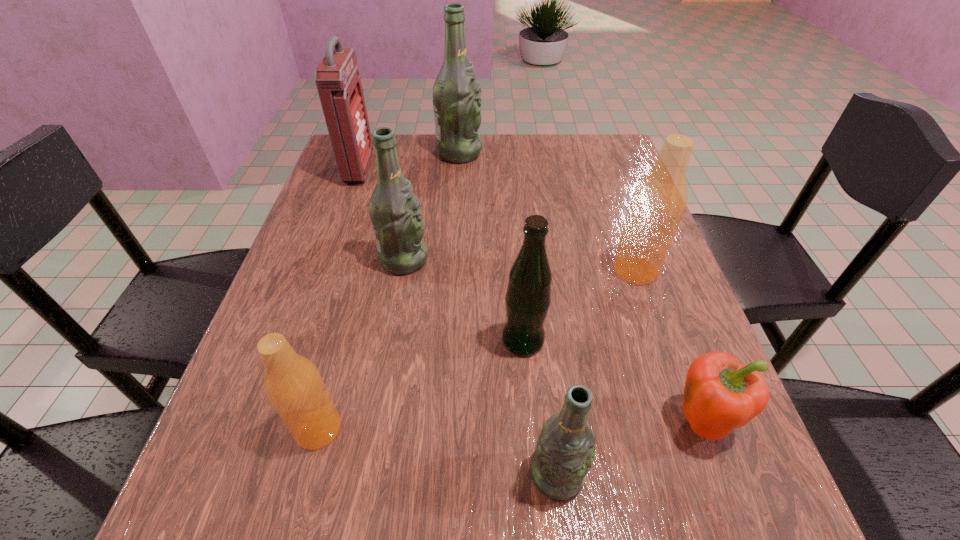
The image size is (960, 540). In the image, there is a desktop. Identify the location of free space at the near edge. (442, 497).

Find the location of `blank space at the left edge of the desktop`. blank space at the left edge of the desktop is located at coordinates (256, 443).

In the image, there is a desktop. Identify the location of vacant space at the right edge. The image size is (960, 540). (639, 405).

Identify the location of free spot between the left tan beer bottle and the pepper. This screenshot has width=960, height=540. (511, 425).

Where is `empty space between the shortest object and the third nearest green beer bottle`? Image resolution: width=960 pixels, height=540 pixels. empty space between the shortest object and the third nearest green beer bottle is located at coordinates (553, 340).

The image size is (960, 540). Find the location of `vacant space that's between the smallest green beer bottle and the farther tan beer bottle`. vacant space that's between the smallest green beer bottle and the farther tan beer bottle is located at coordinates (596, 372).

You are a GUI agent. You are given a task and a screenshot of the screen. Output one action in this format:
    pyautogui.click(x=<x>, y=<y>)
    Task: Click on the vacant region between the right tan beer bottle and the nearer tan beer bottle
    This screenshot has height=540, width=960.
    Given the screenshot: What is the action you would take?
    pyautogui.click(x=477, y=349)

I want to click on empty space between the biggest green beer bottle and the left tan beer bottle, so click(389, 291).

Identify the location of free space between the red first-aid kit and the smallest green beer bottle. Image resolution: width=960 pixels, height=540 pixels. (458, 322).

Locate an element on the screen. free space between the nearer tan beer bottle and the leftmost object is located at coordinates (339, 299).